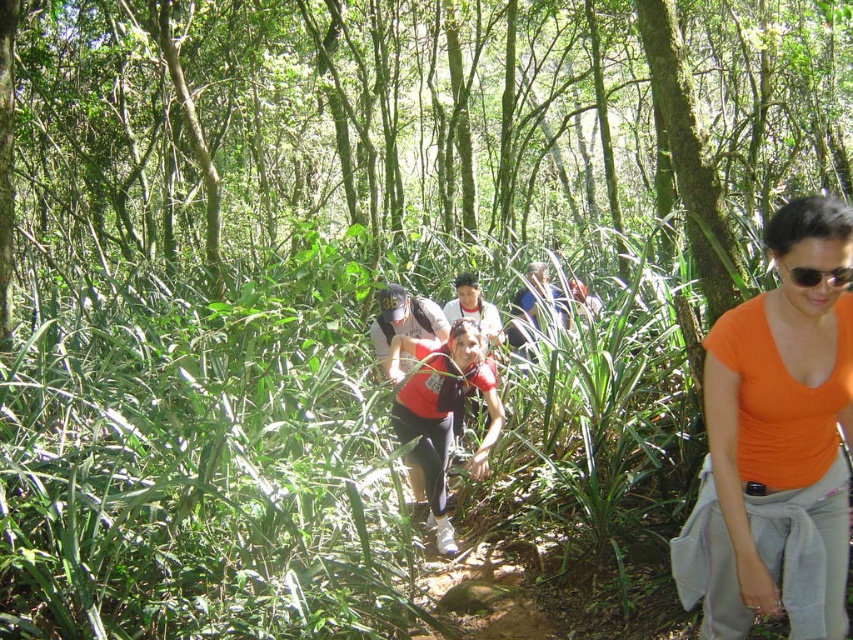
Question: Estimate the real-world distances between objects in this image. Which object is closer to the orange matte shirt at center?

Choices:
 (A) red matte shirt at center
 (B) black plastic sunglasses at right

Answer: (B)

Question: Which of the following is the farthest from the observer?

Choices:
 (A) (804, 314)
 (B) (801, 268)

Answer: (A)

Question: Based on their relative distances, which object is nearer to the black plastic sunglasses at right?

Choices:
 (A) red matte shirt at center
 (B) orange matte shirt at center

Answer: (B)

Question: Can you confirm if red matte shirt at center is positioned to the left of black plastic sunglasses at right?

Choices:
 (A) yes
 (B) no

Answer: (A)

Question: Does orange matte shirt at center have a greater width compared to red matte shirt at center?

Choices:
 (A) yes
 (B) no

Answer: (B)

Question: Can you confirm if orange matte shirt at center is thinner than black plastic sunglasses at right?

Choices:
 (A) yes
 (B) no

Answer: (B)